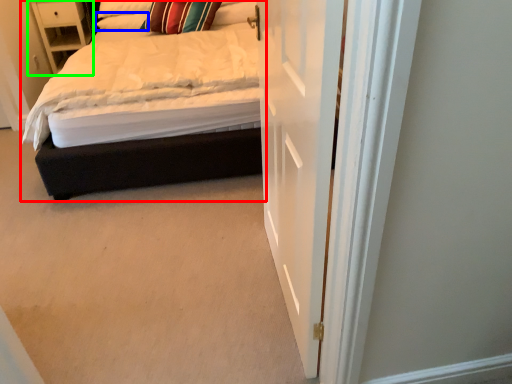
Question: Considering the real-world distances, which object is farthest from bed (highlighted by a red box)? pillow (highlighted by a blue box) or nightstand (highlighted by a green box)?

Choices:
 (A) pillow
 (B) nightstand

Answer: (B)